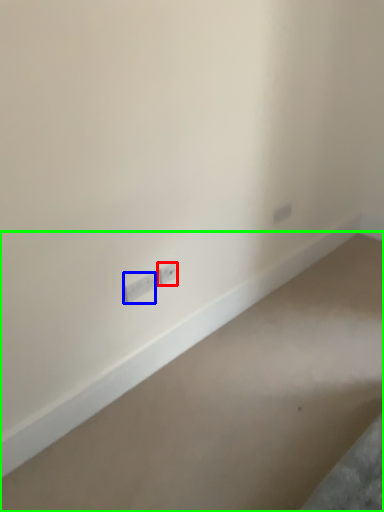
Question: Which object is the farthest from power plugs and sockets (highlighted by a red box)? Choose among these: power plugs and sockets (highlighted by a blue box) or concrete (highlighted by a green box).

Choices:
 (A) power plugs and sockets
 (B) concrete

Answer: (B)